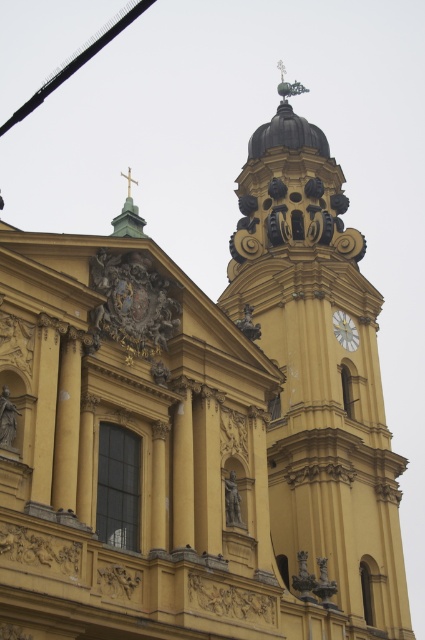
Is yellow matte tower at upper right closer to camera compared to white marble clock at upper center?

Yes, yellow matte tower at upper right is closer to the viewer.

Which is behind, point (323, 134) or point (342, 342)?

Point (323, 134)

Identify the location of yellow matte tower at upper right. pos(319,380).